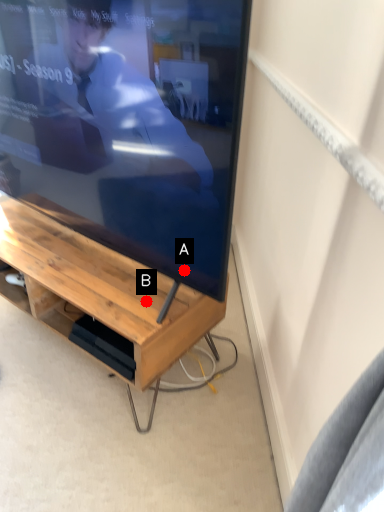
Question: Two points are circled on the image, labeled by A and B beside each circle. Which point is closer to the camera taking this photo?

Choices:
 (A) A is closer
 (B) B is closer

Answer: (A)